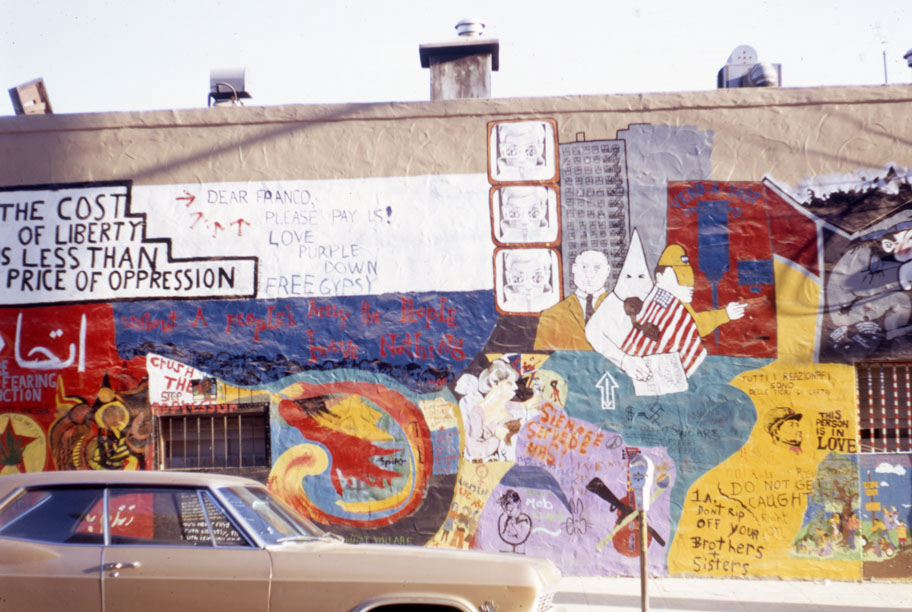
Where is `tan painted wall`? The width and height of the screenshot is (912, 612). tan painted wall is located at coordinates [x=426, y=160], [x=772, y=147], [x=162, y=146].